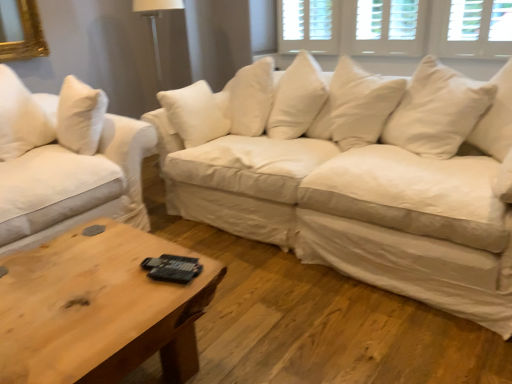
Question: Is white cotton couch at left, which is counted as the 2th studio couch, starting from the right, inside or outside of wooden rustic coffee table at center?

Choices:
 (A) inside
 (B) outside

Answer: (B)

Question: Considering their positions, is white cotton couch at left, which is counted as the 2th studio couch, starting from the right, located in front of or behind wooden rustic coffee table at center?

Choices:
 (A) front
 (B) behind

Answer: (B)

Question: Based on their relative distances, which object is nearer to the white wood window at upper center, the second window when ordered from right to left?

Choices:
 (A) wooden rustic coffee table at center
 (B) white cotton couch at center, which is counted as the 1th studio couch, starting from the right
 (C) white wood blinds at upper center, the 1th window in the right-to-left sequence
 (D) white cotton couch at left, the 1th studio couch in the left-to-right sequence

Answer: (C)

Question: Estimate the real-world distances between objects in this image. Which object is closer to the wooden rustic coffee table at center?

Choices:
 (A) white cotton couch at center, the 2th studio couch when ordered from left to right
 (B) white wood window at upper center, the first window from the left
 (C) white wood blinds at upper center, which ranks as the second window in left-to-right order
 (D) white cotton couch at left, the 1th studio couch in the left-to-right sequence

Answer: (D)